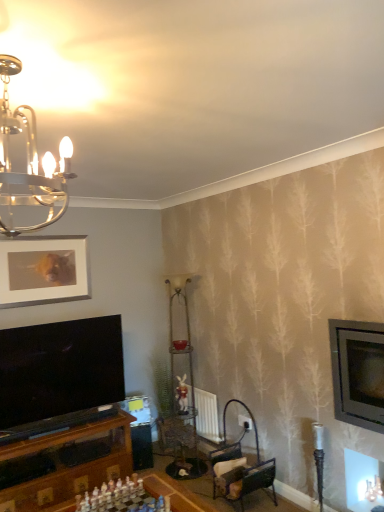
Describe the element at coordinates (43, 270) in the screenshot. I see `matte white picture frame at upper left` at that location.

This screenshot has width=384, height=512. Describe the element at coordinates (358, 372) in the screenshot. I see `metallic silver television at right` at that location.

Identify the location of metallic chandelier at upper left. (27, 163).

Locate an element on the screen. The height and width of the screenshot is (512, 384). white textured radiator at center is located at coordinates (207, 415).

Image resolution: width=384 pixels, height=512 pixels. What do you see at coordinates (240, 474) in the screenshot?
I see `metallic dark brown chair at lower center` at bounding box center [240, 474].

Locate an element on the screen. matte white picture frame at upper left is located at coordinates (43, 270).

From the image's perspective, relative to matte plastic rabbit at center, is metallic silver television at right above or below?

metallic silver television at right is situated higher than matte plastic rabbit at center in the image.

In terms of size, does metallic silver television at right appear bigger or smaller than matte plastic rabbit at center?

metallic silver television at right is bigger than matte plastic rabbit at center.

Considering the positions of objects metallic silver television at right and matte plastic rabbit at center in the image provided, who is behind, metallic silver television at right or matte plastic rabbit at center?

matte plastic rabbit at center is more distant.

You are a GUI agent. You are given a task and a screenshot of the screen. Output one action in this format:
    pyautogui.click(x=<x>, y=<y>)
    Task: Click on the lamp in front of the white plastic chess set at center
    This screenshot has height=512, width=384.
    Given the screenshot: What is the action you would take?
    coord(27,163)

Which object is closer to the camera, metallic chandelier at upper left or white plastic chess set at center?

metallic chandelier at upper left is in front.

Does metallic chandelier at upper left appear on the left side of white plastic chess set at center?

Yes, metallic chandelier at upper left is to the left of white plastic chess set at center.

Is metallic chandelier at upper left wider or thinner than white plastic chess set at center?

metallic chandelier at upper left is thinner than white plastic chess set at center.

Considering the relative sizes of matte plastic rabbit at center and metallic dark brown chair at lower center in the image provided, is matte plastic rabbit at center shorter than metallic dark brown chair at lower center?

Incorrect, the height of matte plastic rabbit at center does not fall short of that of metallic dark brown chair at lower center.

Consider the image. Does matte plastic rabbit at center come in front of metallic dark brown chair at lower center?

No.

Considering the relative sizes of matte plastic rabbit at center and metallic dark brown chair at lower center in the image provided, is matte plastic rabbit at center bigger than metallic dark brown chair at lower center?

No.

Is matte plastic rabbit at center next to metallic dark brown chair at lower center?

No.

How many degrees apart are the facing directions of matte white picture frame at upper left and metallic silver television at right?

The angular difference between matte white picture frame at upper left and metallic silver television at right is 91.3 degrees.

From the image's perspective, which is below, matte white picture frame at upper left or metallic silver television at right?

metallic silver television at right appears lower in the image.

From a real-world perspective, does matte white picture frame at upper left sit lower than metallic silver television at right?

No, from a real-world perspective, matte white picture frame at upper left is not under metallic silver television at right.

Could you tell me if metallic silver television at right is facing metallic chandelier at upper left?

Yes, metallic silver television at right is facing metallic chandelier at upper left.

Is the surface of metallic silver television at right in direct contact with metallic chandelier at upper left?

No, metallic silver television at right is not next to metallic chandelier at upper left.

Does metallic silver television at right have a greater height compared to metallic chandelier at upper left?

Indeed, metallic silver television at right has a greater height compared to metallic chandelier at upper left.

From a real-world perspective, relative to metallic chandelier at upper left, is metallic silver television at right vertically above or below?

In terms of real-world spatial position, metallic silver television at right is below metallic chandelier at upper left.

Considering the relative positions of metallic silver television at right and metallic dark brown chair at lower center in the image provided, is metallic silver television at right to the right of metallic dark brown chair at lower center from the viewer's perspective?

Indeed, metallic silver television at right is positioned on the right side of metallic dark brown chair at lower center.

In terms of width, does metallic silver television at right look wider or thinner when compared to metallic dark brown chair at lower center?

metallic silver television at right is wider than metallic dark brown chair at lower center.

From a real-world perspective, between metallic silver television at right and metallic dark brown chair at lower center, who is vertically lower?

In real-world perspective, metallic dark brown chair at lower center is lower.

Consider the image. Are metallic silver television at right and metallic dark brown chair at lower center making contact?

They are not placed beside each other.

Is point (198, 411) positioned before point (371, 336)?

No, (198, 411) is further to viewer.

Is white textured radiator at center at the left side of metallic silver television at right?

Yes.

Does white textured radiator at center have a greater height compared to metallic silver television at right?

In fact, white textured radiator at center may be shorter than metallic silver television at right.

The width and height of the screenshot is (384, 512). I want to click on television that is above the matte plastic rabbit at center (from the image's perspective), so click(358, 372).

Where is `lamp that appears on the left of white plastic chess set at center`? lamp that appears on the left of white plastic chess set at center is located at coordinates (27, 163).

Based on their spatial positions, is metallic chandelier at upper left or metallic silver television at right closer to matte white picture frame at upper left?

Among the two, metallic chandelier at upper left is located nearer to matte white picture frame at upper left.

Estimate the real-world distances between objects in this image. Which object is further from matte white picture frame at upper left, metallic dark brown chair at lower center or white plastic chess set at center?

The object further to matte white picture frame at upper left is metallic dark brown chair at lower center.

From the image, which object appears to be nearer to matte white picture frame at upper left, matte plastic rabbit at center or white textured radiator at center?

matte plastic rabbit at center is positioned closer to the anchor matte white picture frame at upper left.

From the image, which object appears to be farther from white plastic chess set at center, matte plastic rabbit at center or metallic chandelier at upper left?

metallic chandelier at upper left is positioned further to the anchor white plastic chess set at center.

When comparing their distances from matte white picture frame at upper left, does matte plastic rabbit at center or metallic chandelier at upper left seem closer?

Based on the image, matte plastic rabbit at center appears to be nearer to matte white picture frame at upper left.

Based on their spatial positions, is white textured radiator at center or matte plastic rabbit at center further from white plastic chess set at center?

white textured radiator at center is further to white plastic chess set at center.

Looking at the image, which one is located further to matte plastic rabbit at center, metallic silver television at right or metallic dark brown chair at lower center?

metallic silver television at right is further to matte plastic rabbit at center.

Estimate the real-world distances between objects in this image. Which object is further from white plastic chess set at center, matte white picture frame at upper left or metallic silver television at right?

Among the two, matte white picture frame at upper left is located further to white plastic chess set at center.

Where is `board game between metallic chandelier at upper left and metallic silver television at right from left to right`? board game between metallic chandelier at upper left and metallic silver television at right from left to right is located at coordinates (122, 498).

Locate an element on the screen. radiator situated between matte white picture frame at upper left and metallic silver television at right from left to right is located at coordinates point(207,415).

This screenshot has width=384, height=512. I want to click on toy between matte white picture frame at upper left and metallic dark brown chair at lower center, so click(x=182, y=395).

Image resolution: width=384 pixels, height=512 pixels. Identify the location of television between metallic chandelier at upper left and white textured radiator at center from front to back. (358, 372).